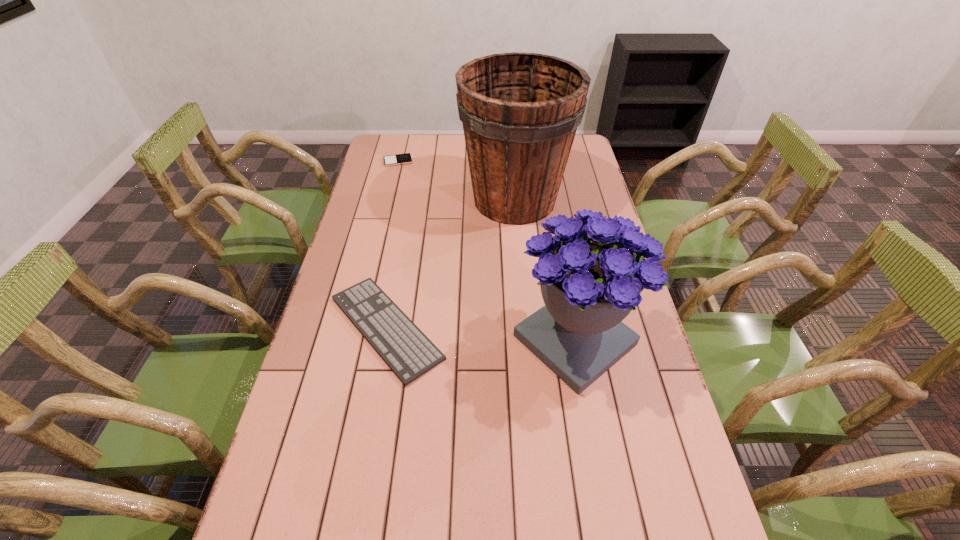
Where is `free space between the bouquet and the third tallest object`? The width and height of the screenshot is (960, 540). free space between the bouquet and the third tallest object is located at coordinates (481, 334).

Find the location of a particular element. vacant point located between the farthest object and the bouquet is located at coordinates (487, 251).

The width and height of the screenshot is (960, 540). In order to click on vacant region between the iPod and the computer keyboard in this screenshot , I will do `click(392, 245)`.

Where is `free space between the iPod and the bouquet`? free space between the iPod and the bouquet is located at coordinates (487, 251).

Locate an element on the screen. This screenshot has width=960, height=540. free point between the farthest object and the bouquet is located at coordinates (487, 251).

At what (x,y) coordinates should I click in order to perform the action: click on vacant space in between the shortest object and the second shortest object. Please return your answer as a coordinate pair (x, y). Looking at the image, I should click on (392, 245).

This screenshot has height=540, width=960. I want to click on free point between the computer keyboard and the shortest object, so click(392, 245).

Choose which object is the nearest neighbor to the bouquet. Please provide its 2D coordinates. Your answer should be formatted as a tuple, i.e. [(x, y)], where the tuple contains the x and y coordinates of a point satisfying the conditions above.

[(409, 353)]

You are a GUI agent. You are given a task and a screenshot of the screen. Output one action in this format:
    pyautogui.click(x=<x>, y=<y>)
    Task: Click on the third closest object to the third tallest object
    This screenshot has height=540, width=960.
    Given the screenshot: What is the action you would take?
    pyautogui.click(x=399, y=159)

You are a GUI agent. You are given a task and a screenshot of the screen. Output one action in this format:
    pyautogui.click(x=<x>, y=<y>)
    Task: Click on the vacant space that satisfies the following two spatial constraints: 1. on the front side of the bucket; 2. on the left side of the shortest object
    
    Given the screenshot: What is the action you would take?
    pyautogui.click(x=389, y=200)